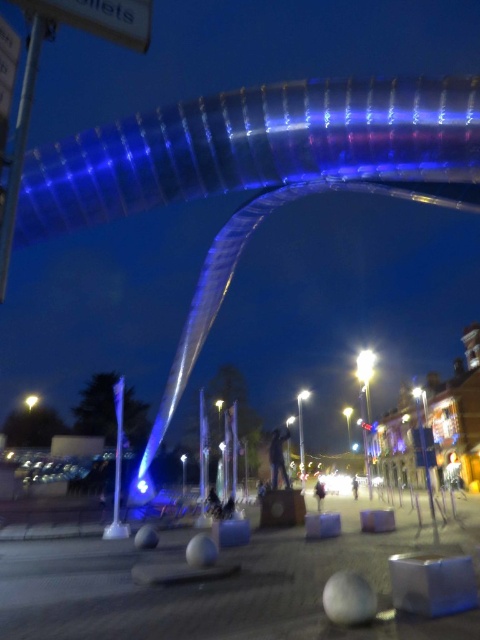
Question: Among these objects, which one is farthest from the camera?

Choices:
 (A) yellow glass light at center
 (B) white glossy streetlight at center
 (C) metallic pole at center

Answer: (A)

Question: Estimate the real-world distances between objects in this image. Which object is farther from the white glossy pole at center?

Choices:
 (A) metallic pole at center
 (B) white plastic sign at upper left
 (C) white glossy streetlight at center
 (D) yellow glass light at center

Answer: (D)

Question: Can you confirm if white plastic sign at upper left is bigger than white glossy streetlight at center?

Choices:
 (A) yes
 (B) no

Answer: (B)

Question: Does metallic pole at center have a larger size compared to yellow glass light at center?

Choices:
 (A) no
 (B) yes

Answer: (B)

Question: Which is farther from the white glossy streetlight at center?

Choices:
 (A) metallic pole at center
 (B) yellow glass light at center
 (C) white plastic sign at upper left

Answer: (B)

Question: Where is white plastic sign at upper left located in relation to yellow glass light at center in the image?

Choices:
 (A) left
 (B) right

Answer: (B)